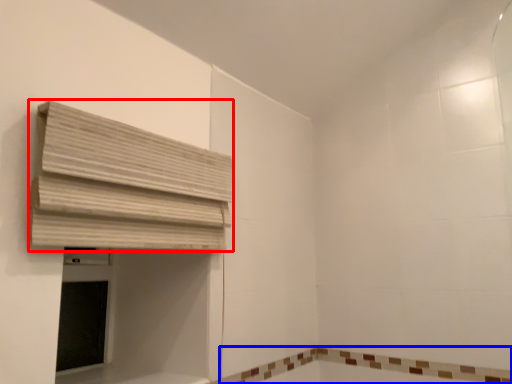
Question: Which object is closer to the camera taking this photo, curtain (highlighted by a red box) or bath (highlighted by a blue box)?

Choices:
 (A) curtain
 (B) bath

Answer: (A)